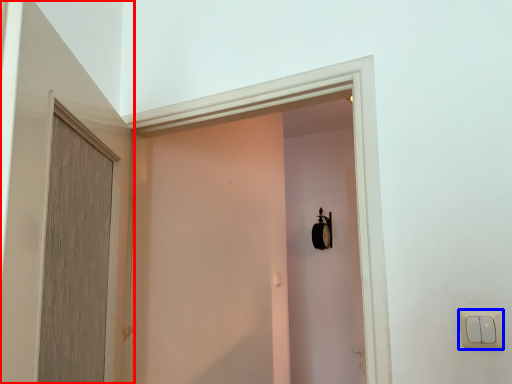
Question: Which of the following is the closest to the observer, door (highlighted by a red box) or light switch (highlighted by a blue box)?

Choices:
 (A) door
 (B) light switch

Answer: (A)